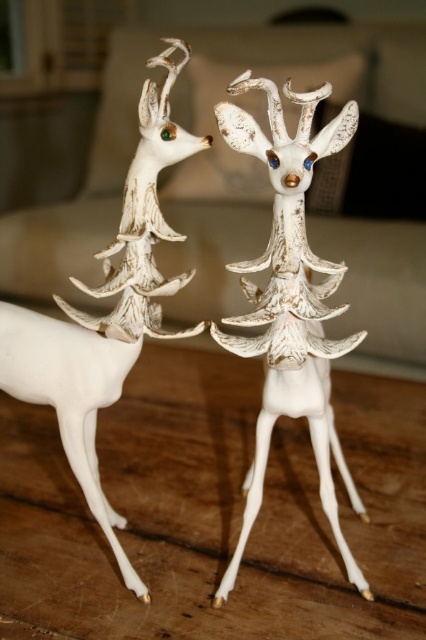
Looking at this image, you are standing in front of a table with two white deer figurines. You want to place a small candle exactly at the center of the table. The coordinates of the center are given as point (290, 301). Which deer figurine, the white matte deer at center or the other one, is located at this central point?

The point (290, 301) indicates the white matte deer at center, so placing the candle there would position it directly on top of this deer figurine.

You are organizing a display on a narrow shelf and have two white deer figurines, the white matte deer at center and the white porcelain deer at center. You want to place them side by side without overlapping. Given the shelf space is limited, which deer should you place first to ensure they both fit?

The white matte deer at center has a lesser width compared to the white porcelain deer at center, so you should place the wider white porcelain deer at center first to accommodate its larger size, then the narrower white matte deer at center next to it.

You are a photographer setting up a shot of the white matte deer at center. Your camera is positioned at a standard height. If the deer is 28.36 inches away from the camera, will it fill the frame adequately?

The white matte deer at center is 28.36 inches away from the camera. Whether it fills the frame depends on the lens focal length and sensor size. A standard lens might require moving closer or using a wider angle to ensure the deer fills the frame.